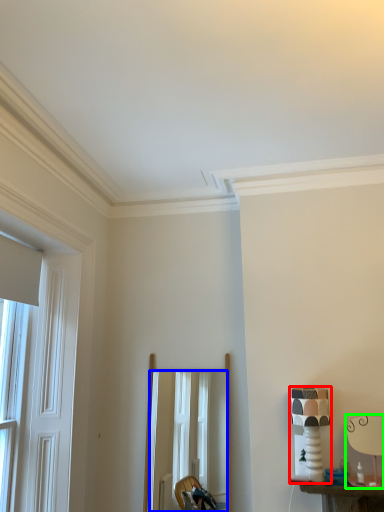
Question: Which is farther away from table lamp (highlighted by a red box)? mirror (highlighted by a blue box) or table lamp (highlighted by a green box)?

Choices:
 (A) mirror
 (B) table lamp

Answer: (A)